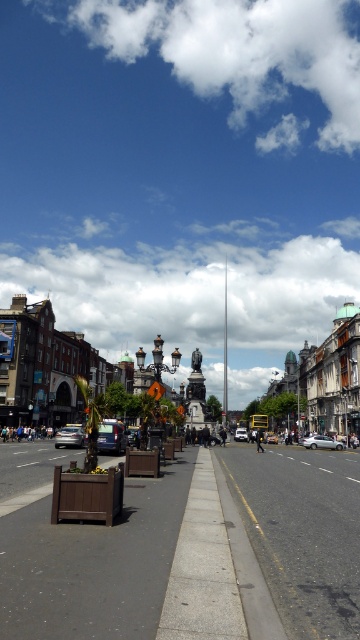
Question: Among these objects, which one is nearest to the camera?

Choices:
 (A) metallic silver car at left
 (B) silver metallic car at center-right

Answer: (A)

Question: Estimate the real-world distances between objects in this image. Which object is closer to the matte black car at center?

Choices:
 (A) metallic silver car at left
 (B) silver metallic car at center-right
 (C) metallic silver van at center
 (D) transparent glass monument at center

Answer: (A)

Question: Considering the real-world distances, which object is farthest from the silver metallic car at center-right?

Choices:
 (A) metallic silver car at left
 (B) metallic silver van at center
 (C) silver metallic car at center

Answer: (A)

Question: Can you confirm if metallic silver van at center is wider than silver metallic car at center?

Choices:
 (A) yes
 (B) no

Answer: (A)

Question: Is matte black car at center above silver metallic car at center-right?

Choices:
 (A) yes
 (B) no

Answer: (A)

Question: Does matte black car at center come in front of metallic silver van at center?

Choices:
 (A) no
 (B) yes

Answer: (A)